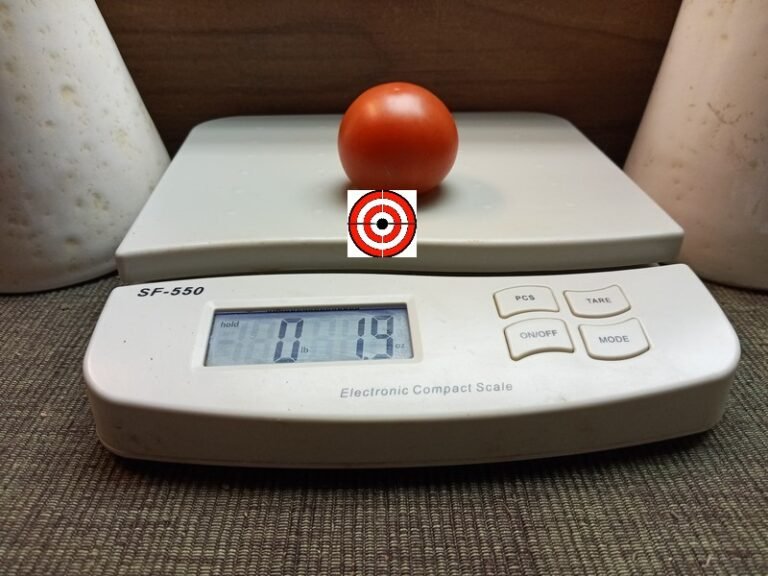
The width and height of the screenshot is (768, 576). What are the coordinates of `digital display` in the screenshot? It's located at (313, 343).